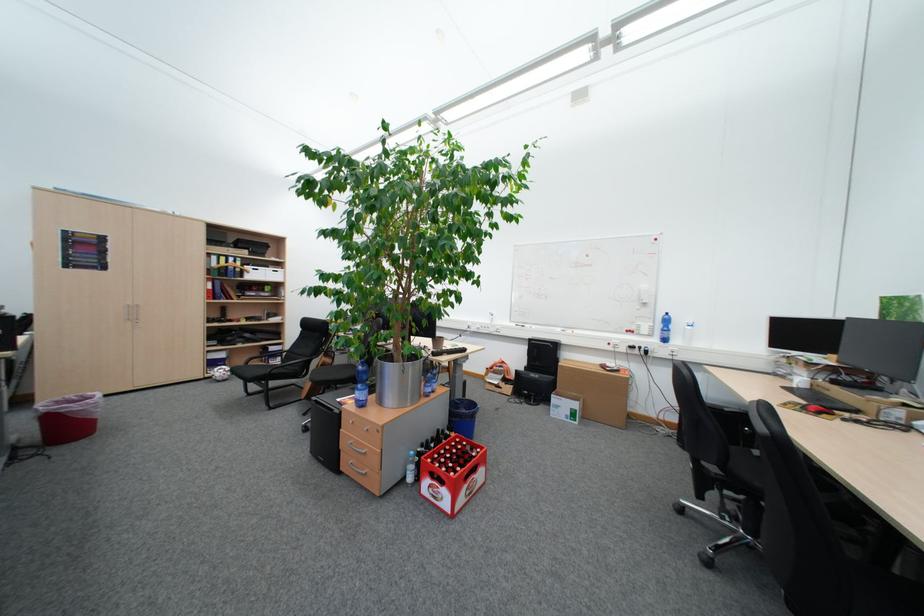
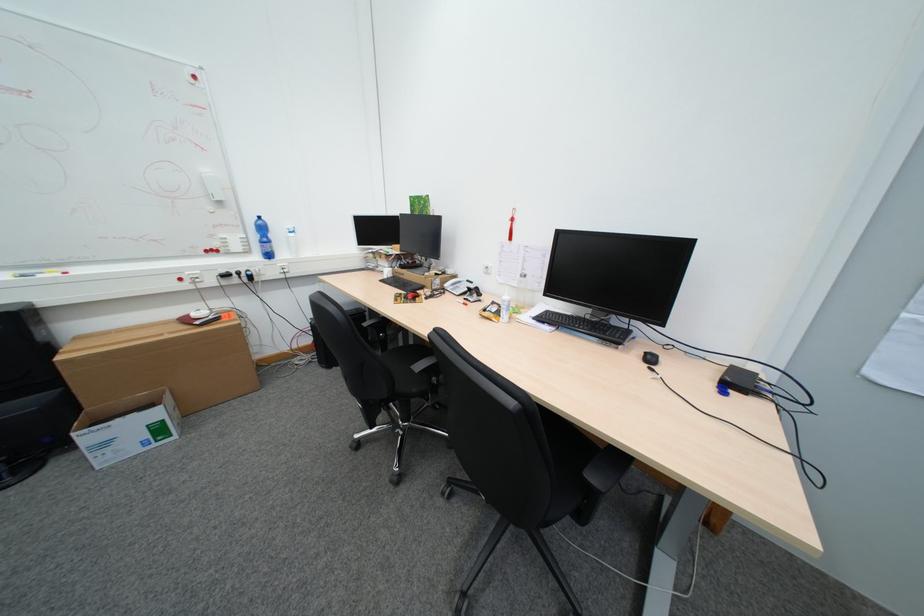
Based on the photo, the images are taken continuously from a first-person perspective. In which direction is your viewpoint rotating?

The rotation direction of the camera is right-down.